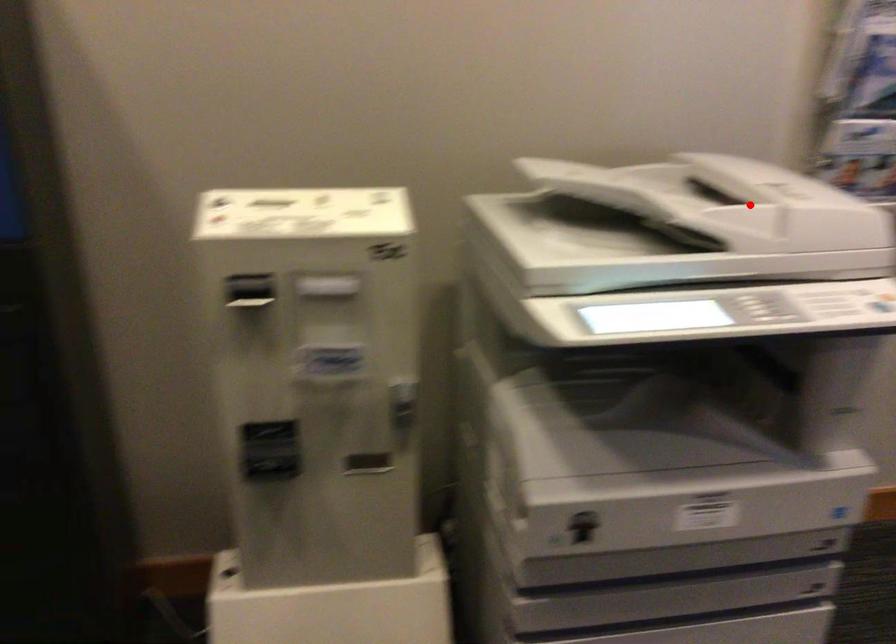
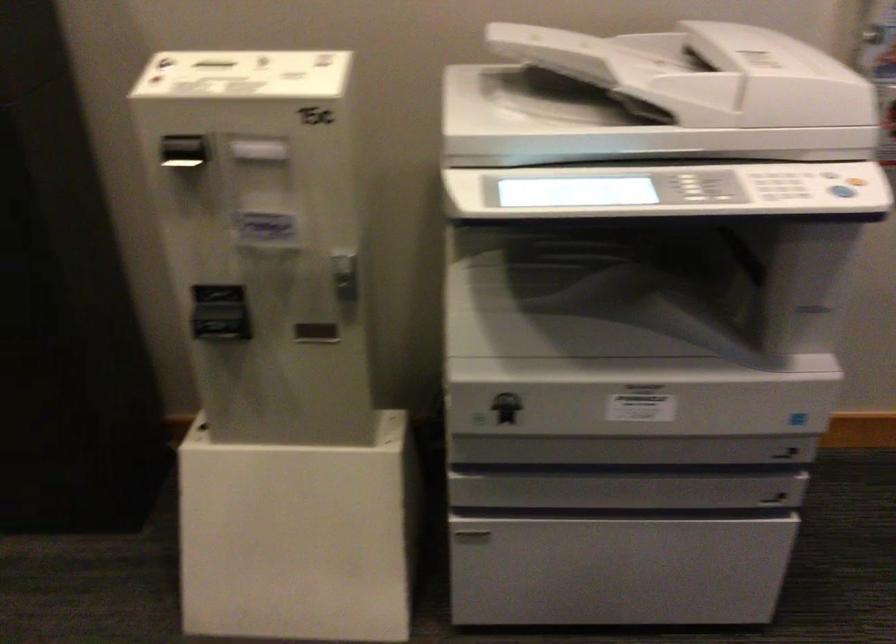
Question: I am providing you with two images of the same scene from different viewpoints. Given a red point in image1, look at the same physical point in image2. Is it:

Choices:
 (A) Closer to the viewpoint
 (B) Farther from the viewpoint

Answer: (A)